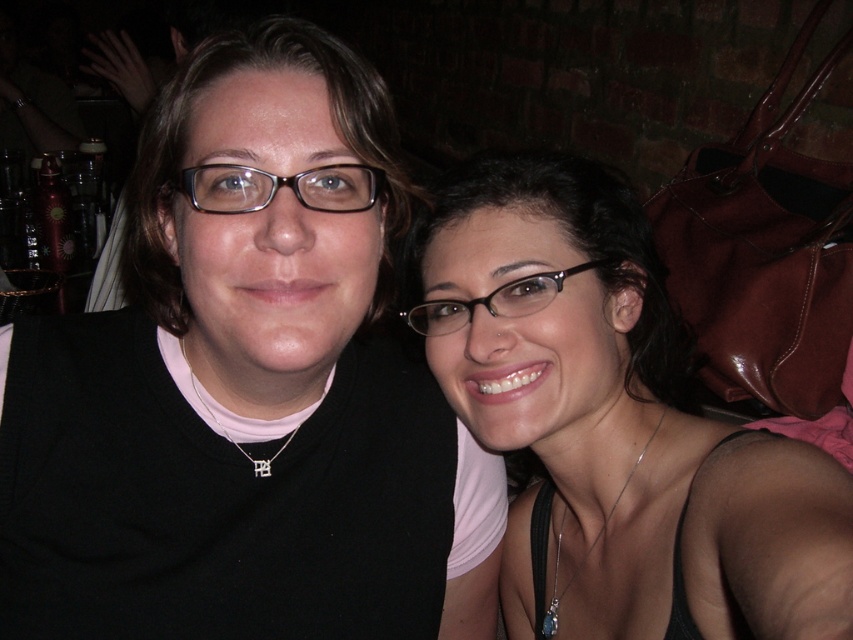
What are the coordinates of the black plastic glasses at center?

The black plastic glasses at center are located at coordinates point (495, 300).

You are standing in the scene and want to pick up the matte black sweater at center. Which direction should you move to reach it?

The matte black sweater at center is located at point 0.614 in the x and 0.281 in the y coordinates, so you should move towards the center of the image to reach it.